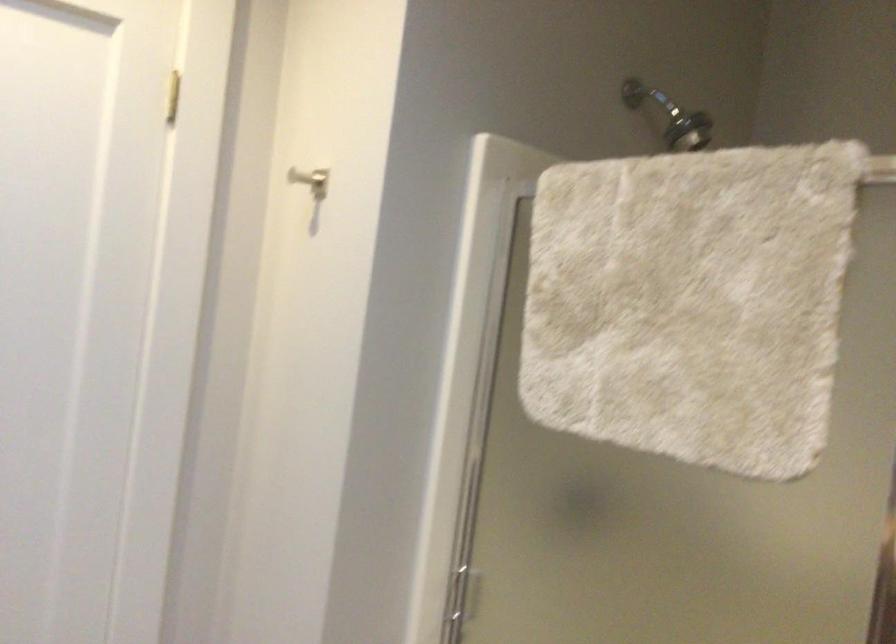
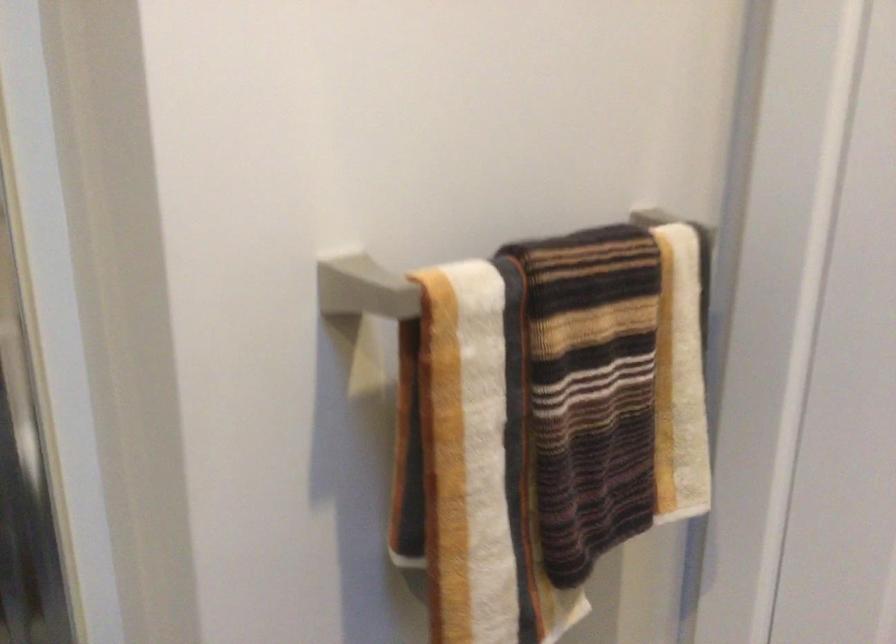
Based on the continuous images, in which direction is the camera rotating?

The camera rotated toward right-down.